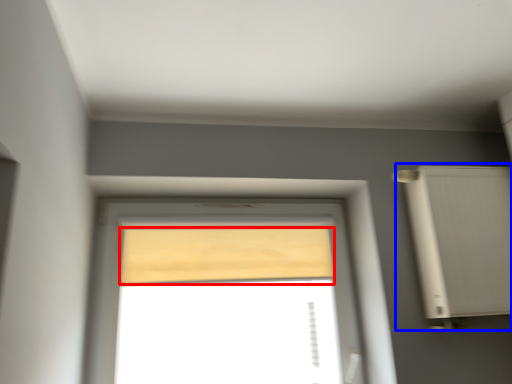
Question: Which of the following is the farthest to the observer, curtain (highlighted by a red box) or air conditioner (highlighted by a blue box)?

Choices:
 (A) curtain
 (B) air conditioner

Answer: (A)